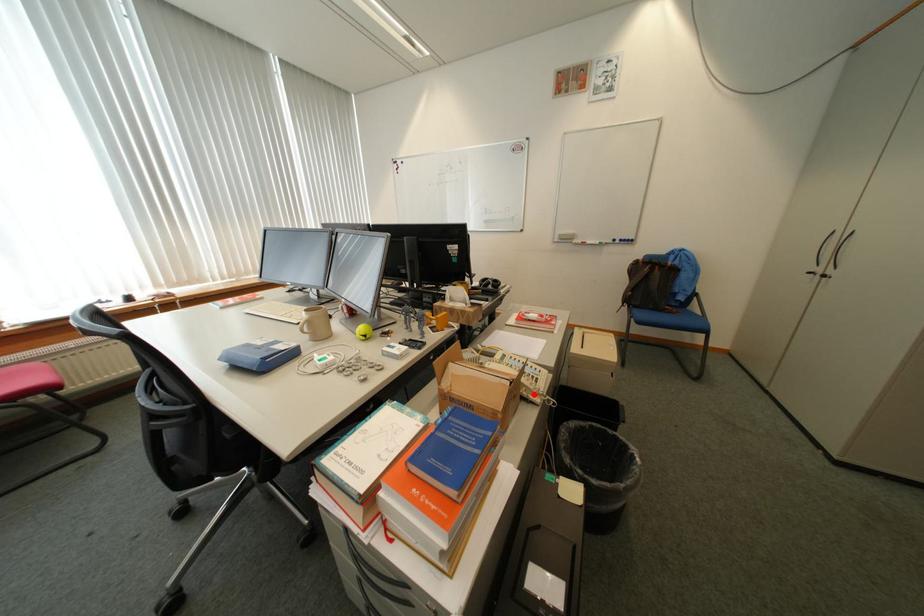
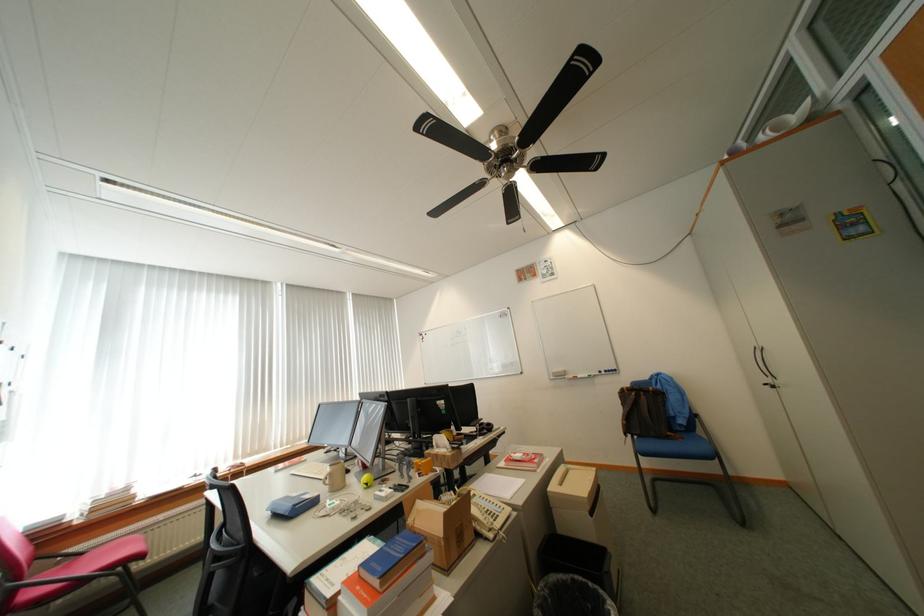
Where in the second image is the point corresponding to the highlighted location from the first image?

(488, 530)